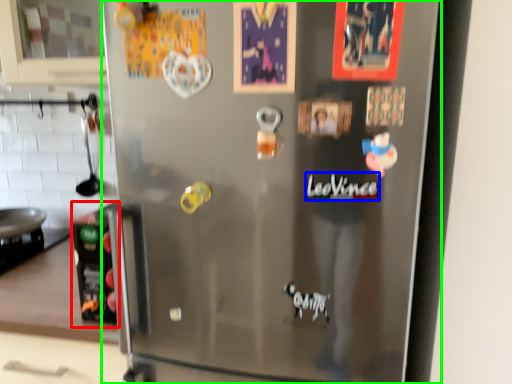
Question: Which object is positioned farthest from appliance (highlighted by a red box)? Select from writing (highlighted by a blue box) and refrigerator (highlighted by a green box).

Choices:
 (A) writing
 (B) refrigerator

Answer: (B)